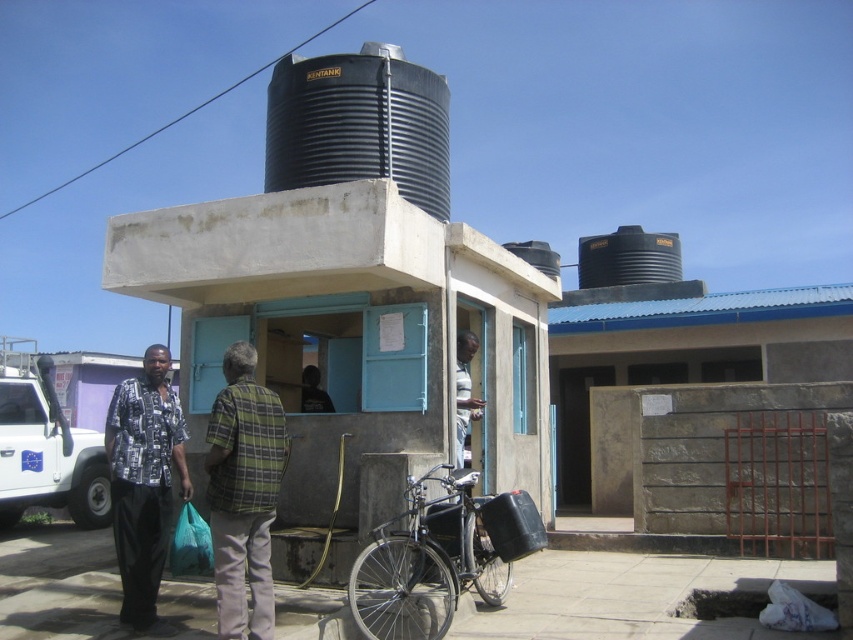
Consider the image. You are standing in front of the water kiosk and want to reach the black corrugated silo at upper center to refill your water container. Considering your height is 1.7 meters, can you comfortably reach the silo without any assistance?

The black corrugated silo at upper center is 7.78 meters from viewer, so it is too far away for you to reach comfortably without assistance. You would need to use a ladder or ask for help to access it.